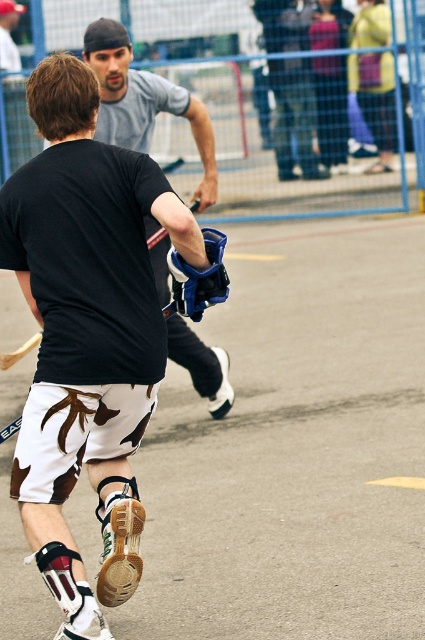
Question: Does white leather shorts at center have a lesser width compared to matte gray shirt at upper center?

Choices:
 (A) no
 (B) yes

Answer: (A)

Question: Which point is farther from the camera taking this photo?

Choices:
 (A) (209, 394)
 (B) (124, 422)

Answer: (A)

Question: Does white leather shorts at center appear under matte gray shirt at upper center?

Choices:
 (A) no
 (B) yes

Answer: (B)

Question: Which point is farther from the camera taking this photo?

Choices:
 (A) (170, 355)
 (B) (183, 248)

Answer: (A)

Question: Can you confirm if white leather shorts at center is positioned to the left of matte gray shirt at upper center?

Choices:
 (A) yes
 (B) no

Answer: (A)